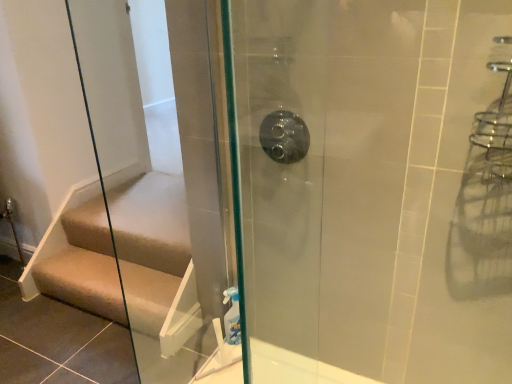
Question: Can you confirm if brown leather stairs at lower left is shorter than matte silver showerhead at center?

Choices:
 (A) no
 (B) yes

Answer: (B)

Question: Does brown leather stairs at lower left lie behind matte silver showerhead at center?

Choices:
 (A) no
 (B) yes

Answer: (B)

Question: Is matte silver showerhead at center completely or partially inside brown leather stairs at lower left?

Choices:
 (A) yes
 (B) no

Answer: (B)

Question: Considering the relative sizes of brown leather stairs at lower left and matte silver showerhead at center in the image provided, is brown leather stairs at lower left smaller than matte silver showerhead at center?

Choices:
 (A) no
 (B) yes

Answer: (A)

Question: Is brown leather stairs at lower left beside matte silver showerhead at center?

Choices:
 (A) yes
 (B) no

Answer: (B)

Question: Does brown leather stairs at lower left have a greater height compared to matte silver showerhead at center?

Choices:
 (A) yes
 (B) no

Answer: (B)

Question: Considering the relative sizes of matte silver showerhead at center and brown leather stairs at lower left in the image provided, is matte silver showerhead at center wider than brown leather stairs at lower left?

Choices:
 (A) yes
 (B) no

Answer: (B)

Question: From a real-world perspective, does matte silver showerhead at center sit lower than brown leather stairs at lower left?

Choices:
 (A) no
 (B) yes

Answer: (A)

Question: Is brown leather stairs at lower left located within matte silver showerhead at center?

Choices:
 (A) no
 (B) yes

Answer: (A)

Question: From the image's perspective, is matte silver showerhead at center located above brown leather stairs at lower left?

Choices:
 (A) yes
 (B) no

Answer: (A)

Question: From the image's perspective, is matte silver showerhead at center beneath brown leather stairs at lower left?

Choices:
 (A) no
 (B) yes

Answer: (A)

Question: Is matte silver showerhead at center turned away from brown leather stairs at lower left?

Choices:
 (A) yes
 (B) no

Answer: (B)

Question: In terms of height, does matte silver showerhead at center look taller or shorter compared to brown leather stairs at lower left?

Choices:
 (A) tall
 (B) short

Answer: (A)